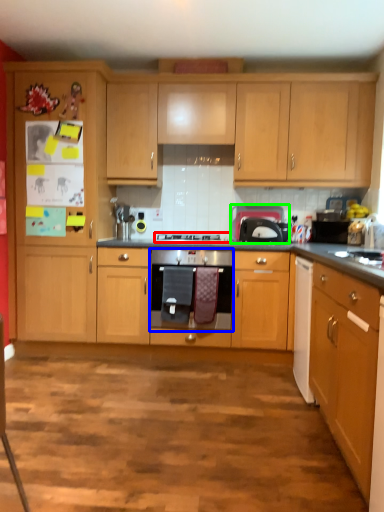
Question: Estimate the real-world distances between objects in this image. Which object is closer to gas stove (highlighted by a red box), kitchen appliance (highlighted by a blue box) or appliance (highlighted by a green box)?

Choices:
 (A) kitchen appliance
 (B) appliance

Answer: (B)